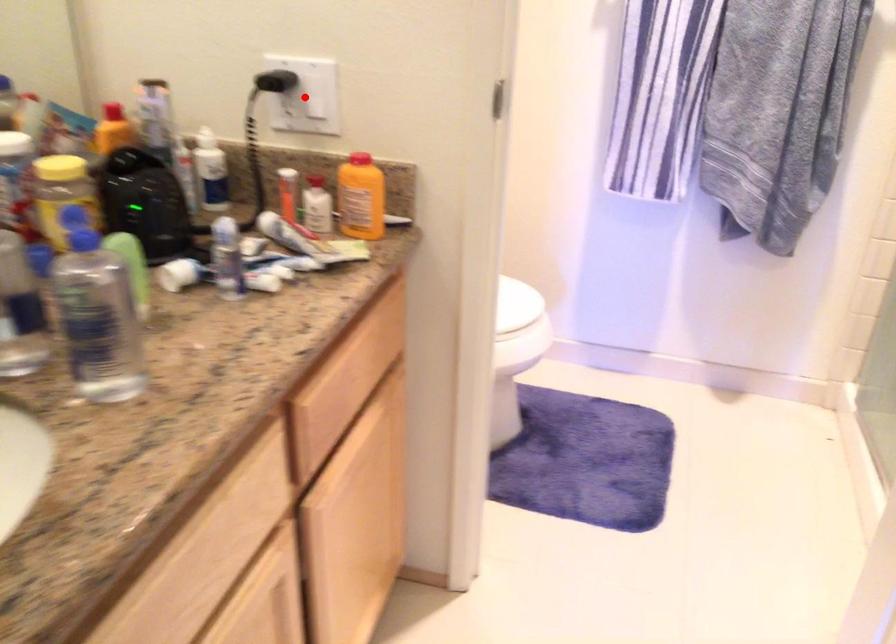
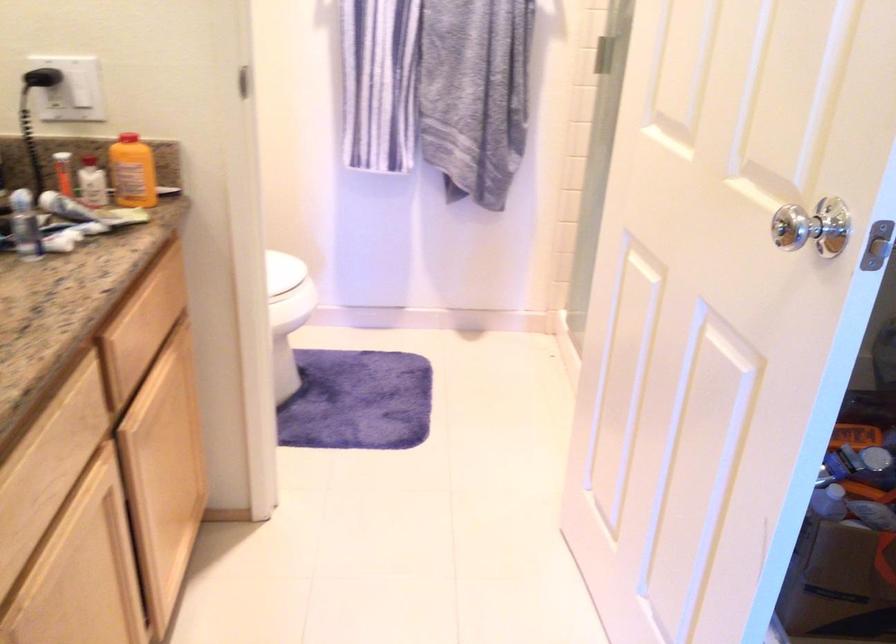
Question: I am providing you with two images of the same scene from different viewpoints. Given a red point in image1, look at the same physical point in image2. Is it:

Choices:
 (A) Closer to the viewpoint
 (B) Farther from the viewpoint

Answer: (B)